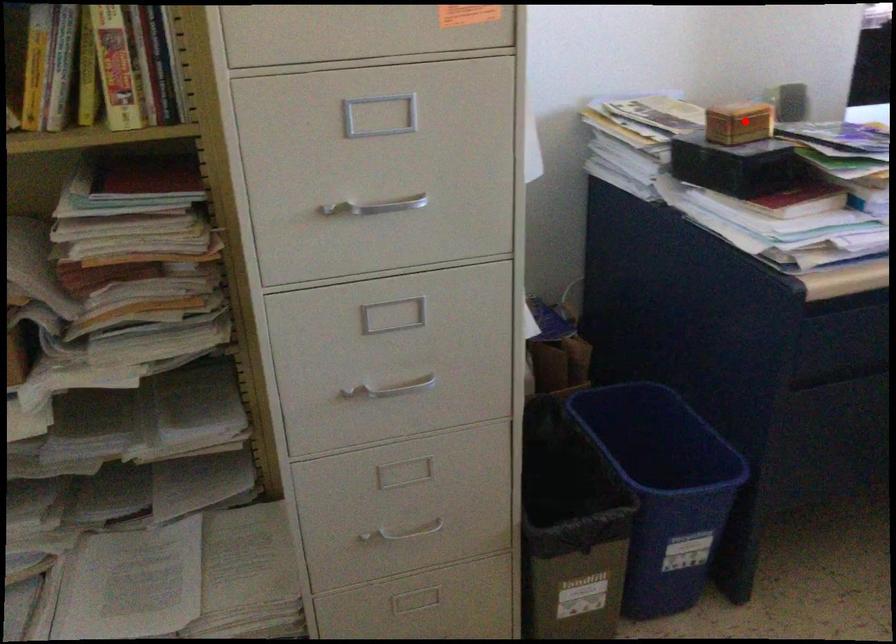
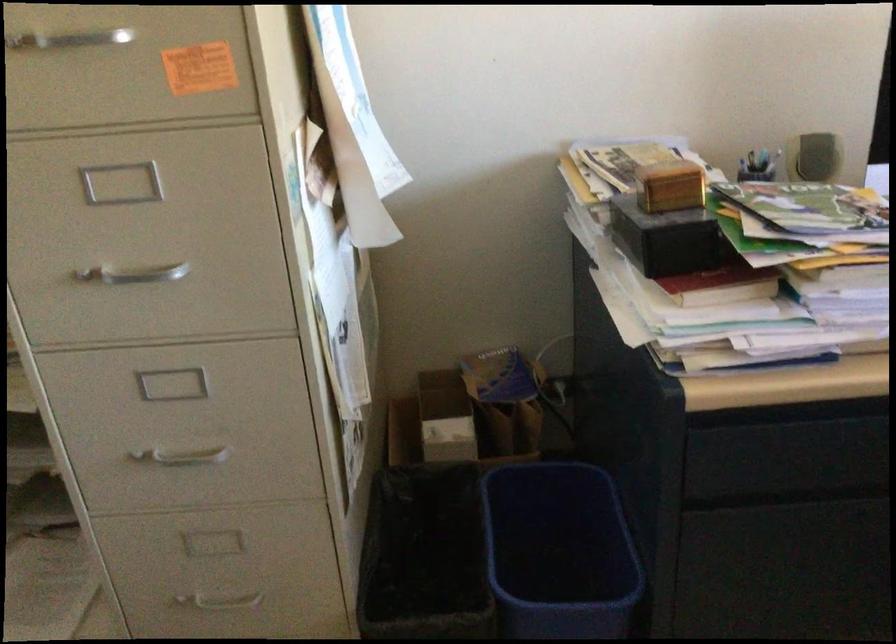
Question: I am providing you with two images of the same scene from different viewpoints. In image1, a red point is highlighted. Considering the same 3D point in image2, which of the following is correct?

Choices:
 (A) It is closer
 (B) It is farther

Answer: (A)